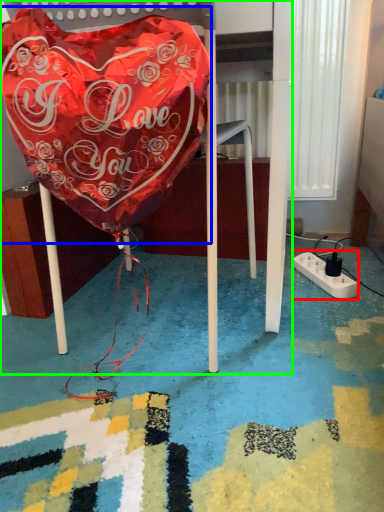
Question: Which object is positioned closest to extension cord (highlighted by a red box)? Select from blanket (highlighted by a blue box) and furniture (highlighted by a green box).

Choices:
 (A) blanket
 (B) furniture

Answer: (B)